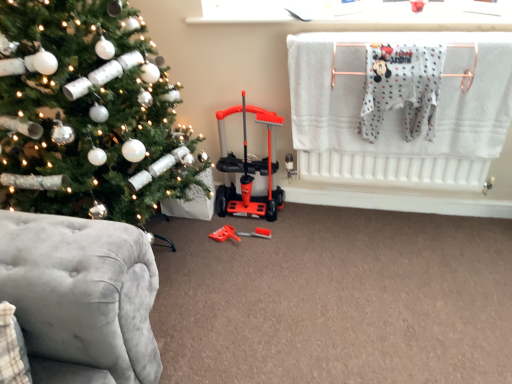
This screenshot has height=384, width=512. What do you see at coordinates (224, 234) in the screenshot?
I see `orange plastic toy at center` at bounding box center [224, 234].

Measure the distance between point (446, 125) and camera.

Point (446, 125) and camera are 1.77 meters apart from each other.

Find the location of a particular element. white cotton onesie at upper right is located at coordinates (402, 87).

What is the approximate width of white cotton onesie at upper right?

white cotton onesie at upper right is 5.75 inches in width.

Locate an element on the screen. Image resolution: width=512 pixels, height=384 pixels. orange plastic toy at center is located at coordinates (224, 234).

Can you confirm if white cotton onesie at upper right is positioned to the left of shiny silver ornaments at left?

Incorrect, white cotton onesie at upper right is not on the left side of shiny silver ornaments at left.

From the image's perspective, is white cotton onesie at upper right above or below shiny silver ornaments at left?

From the image's perspective, white cotton onesie at upper right appears above shiny silver ornaments at left.

Consider the image. Which of these two, white cotton onesie at upper right or shiny silver ornaments at left, stands taller?

shiny silver ornaments at left.

From a real-world perspective, is white cotton onesie at upper right above or below white cotton onesie at upper right?

Clearly, from a real-world perspective, white cotton onesie at upper right is above white cotton onesie at upper right.

How distant is white cotton onesie at upper right from white cotton onesie at upper right?

4.47 inches.

Based on the photo, considering the relative sizes of white cotton onesie at upper right and white cotton onesie at upper right in the image provided, is white cotton onesie at upper right thinner than white cotton onesie at upper right?

In fact, white cotton onesie at upper right might be wider than white cotton onesie at upper right.

Is point (433, 67) behind point (488, 157)?

No, (433, 67) is closer to viewer.

Does shiny silver ornaments at left have a larger size compared to white cotton onesie at upper right?

Correct, shiny silver ornaments at left is larger in size than white cotton onesie at upper right.

Considering the relative positions of shiny silver ornaments at left and white cotton onesie at upper right in the image provided, is shiny silver ornaments at left to the left or to the right of white cotton onesie at upper right?

Based on their positions, shiny silver ornaments at left is located to the left of white cotton onesie at upper right.

Do you think shiny silver ornaments at left is within white cotton onesie at upper right, or outside of it?

shiny silver ornaments at left lies outside white cotton onesie at upper right.

From the image's perspective, does orange plastic baby carriage at center appear higher than white cotton onesie at upper right?

No, from the image's perspective, orange plastic baby carriage at center is not above white cotton onesie at upper right.

Can you confirm if orange plastic baby carriage at center is bigger than white cotton onesie at upper right?

Actually, orange plastic baby carriage at center might be smaller than white cotton onesie at upper right.

From a real-world perspective, which is physically above, orange plastic baby carriage at center or white cotton onesie at upper right?

In real-world perspective, white cotton onesie at upper right is above.

Which is in front, orange plastic baby carriage at center or white cotton onesie at upper right?

Positioned in front is white cotton onesie at upper right.

Is orange plastic baby carriage at center turned away from orange plastic toy at center?

No, orange plastic baby carriage at center is not facing away from orange plastic toy at center.

Considering the positions of points (231, 209) and (236, 238), is point (231, 209) farther from camera compared to point (236, 238)?

Yes, it is behind point (236, 238).

Can you confirm if orange plastic baby carriage at center is smaller than orange plastic toy at center?

No.

Which is correct: orange plastic baby carriage at center is inside orange plastic toy at center, or outside of it?

orange plastic baby carriage at center is located beyond the bounds of orange plastic toy at center.

From a real-world perspective, is white cotton onesie at upper right located higher than white cotton onesie at upper right?

No, from a real-world perspective, white cotton onesie at upper right is not above white cotton onesie at upper right.

Is white cotton onesie at upper right outside of white cotton onesie at upper right?

Yes.

From the image's perspective, is white cotton onesie at upper right located beneath white cotton onesie at upper right?

Actually, white cotton onesie at upper right appears above white cotton onesie at upper right in the image.

In the scene shown: Does white cotton onesie at upper right have a greater width compared to white cotton onesie at upper right?

In fact, white cotton onesie at upper right might be narrower than white cotton onesie at upper right.

Is white cotton onesie at upper right outside of orange plastic toy at center?

Yes, white cotton onesie at upper right is outside of orange plastic toy at center.

In the scene shown: Measure the distance between white cotton onesie at upper right and orange plastic toy at center.

37.60 inches.

Does white cotton onesie at upper right appear on the left side of orange plastic toy at center?

Incorrect, white cotton onesie at upper right is not on the left side of orange plastic toy at center.

Locate an element on the screen. The width and height of the screenshot is (512, 384). laundry above the orange plastic toy at center (from a real-world perspective) is located at coordinates (400, 109).

The image size is (512, 384). I want to click on laundry that is behind the shiny silver ornaments at left, so click(x=400, y=109).

Where is `laundry below the white cotton onesie at upper right (from a real-world perspective)`? laundry below the white cotton onesie at upper right (from a real-world perspective) is located at coordinates (400, 109).

Based on the photo, from the image, which object appears to be farther from white cotton onesie at upper right, orange plastic toy at center or white cotton onesie at upper right?

Among the two, orange plastic toy at center is located further to white cotton onesie at upper right.

Looking at the image, which one is located closer to white cotton onesie at upper right, shiny silver ornaments at left or white cotton onesie at upper right?

The object closer to white cotton onesie at upper right is white cotton onesie at upper right.

From the image, which object appears to be farther from shiny silver ornaments at left, white cotton onesie at upper right or white cotton onesie at upper right?

white cotton onesie at upper right is further to shiny silver ornaments at left.

Considering their positions, is white cotton onesie at upper right positioned further to shiny silver ornaments at left than orange plastic baby carriage at center?

white cotton onesie at upper right is further to shiny silver ornaments at left.

Which object lies further to the anchor point orange plastic toy at center, shiny silver ornaments at left or white cotton onesie at upper right?

Among the two, white cotton onesie at upper right is located further to orange plastic toy at center.

Looking at the image, which one is located further to orange plastic toy at center, white cotton onesie at upper right or white cotton onesie at upper right?

white cotton onesie at upper right is positioned further to the anchor orange plastic toy at center.

From the image, which object appears to be farther from orange plastic toy at center, white cotton onesie at upper right or shiny silver ornaments at left?

white cotton onesie at upper right is further to orange plastic toy at center.

Based on their spatial positions, is shiny silver ornaments at left or orange plastic toy at center closer to white cotton onesie at upper right?

shiny silver ornaments at left is positioned closer to the anchor white cotton onesie at upper right.

The height and width of the screenshot is (384, 512). I want to click on baby carriage between shiny silver ornaments at left and white cotton onesie at upper right in the horizontal direction, so click(249, 170).

Locate an element on the screen. The image size is (512, 384). baby clothe situated between orange plastic toy at center and white cotton onesie at upper right from left to right is located at coordinates (402, 87).

Image resolution: width=512 pixels, height=384 pixels. I want to click on baby carriage between shiny silver ornaments at left and white cotton onesie at upper right from left to right, so click(x=249, y=170).

The width and height of the screenshot is (512, 384). In order to click on toy between shiny silver ornaments at left and white cotton onesie at upper right from left to right in this screenshot , I will do `click(224, 234)`.